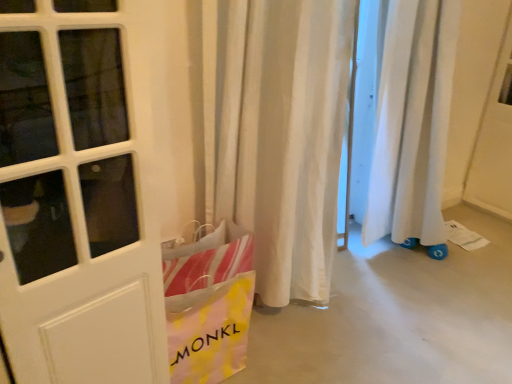
Image resolution: width=512 pixels, height=384 pixels. Identify the location of free spot in front of white fabric curtain at center. (300, 354).